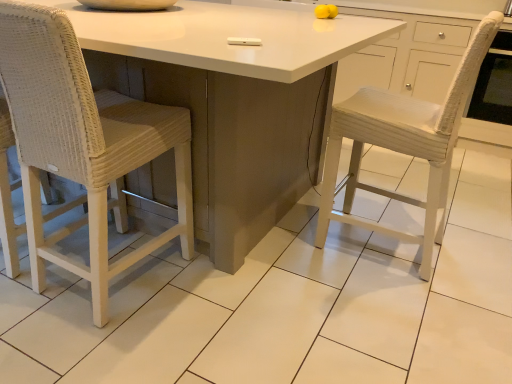
Question: Is woven wicker chair at left to the left of white glossy table at center from the viewer's perspective?

Choices:
 (A) no
 (B) yes

Answer: (A)

Question: Does woven wicker chair at left appear on the right side of white glossy table at center?

Choices:
 (A) no
 (B) yes

Answer: (B)

Question: Is woven wicker chair at left looking in the opposite direction of white glossy table at center?

Choices:
 (A) yes
 (B) no

Answer: (A)

Question: From a real-world perspective, is woven wicker chair at left on white glossy table at center?

Choices:
 (A) yes
 (B) no

Answer: (A)

Question: Is woven wicker chair at left shorter than white glossy table at center?

Choices:
 (A) yes
 (B) no

Answer: (B)

Question: Is woven wicker chair at left wider than white glossy table at center?

Choices:
 (A) yes
 (B) no

Answer: (B)

Question: Is white glossy table at center facing away from woven wicker chair at left?

Choices:
 (A) yes
 (B) no

Answer: (A)

Question: Does white glossy table at center have a lesser width compared to woven wicker chair at left?

Choices:
 (A) no
 (B) yes

Answer: (A)

Question: Is white glossy table at center at the left side of woven wicker chair at left?

Choices:
 (A) no
 (B) yes

Answer: (B)

Question: Does white glossy table at center have a larger size compared to woven wicker chair at left?

Choices:
 (A) yes
 (B) no

Answer: (A)

Question: From the image's perspective, is white glossy table at center over woven wicker chair at left?

Choices:
 (A) no
 (B) yes

Answer: (B)

Question: Is white glossy table at center taller than woven wicker chair at left?

Choices:
 (A) no
 (B) yes

Answer: (A)

Question: Considering the positions of white glossy table at center and woven wicker chair at left in the image, is white glossy table at center wider or thinner than woven wicker chair at left?

Choices:
 (A) wide
 (B) thin

Answer: (A)